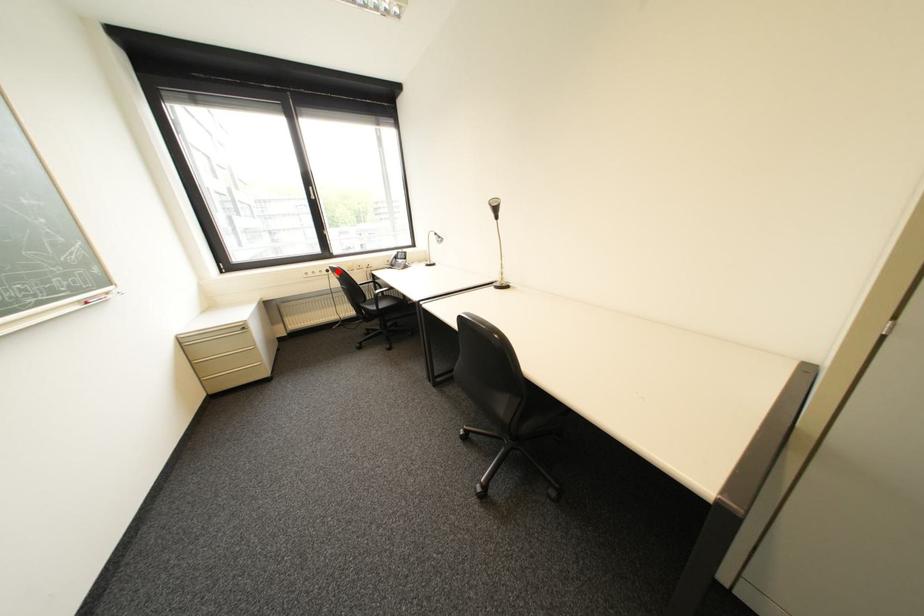
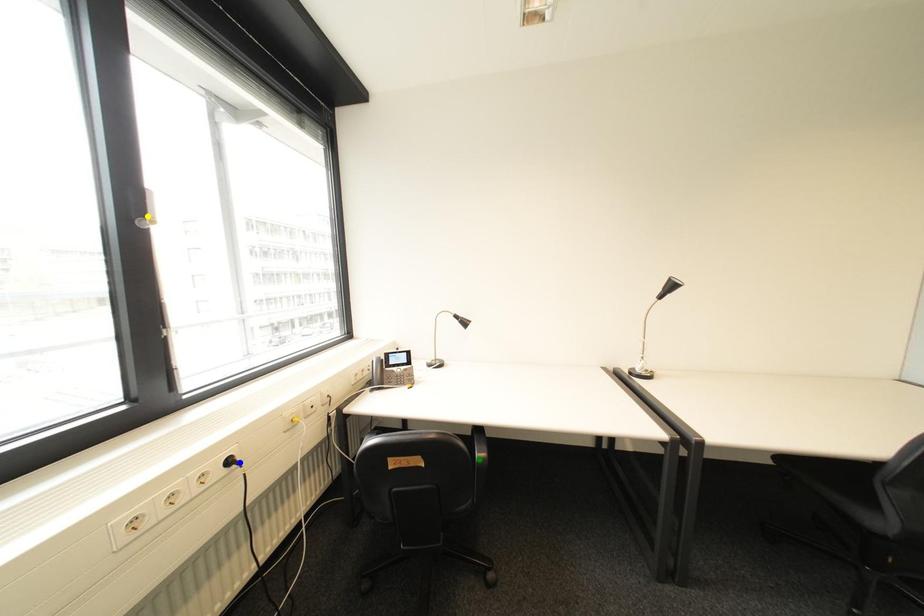
Question: I am providing you with two images of the same scene from different viewpoints. A red point is marked on the first image. You are given multiple points on the second image. Which point in image 2 represents the same 3d spot as the red point in image 1?

Choices:
 (A) yellow point
 (B) green point
 (C) blue point

Answer: (C)